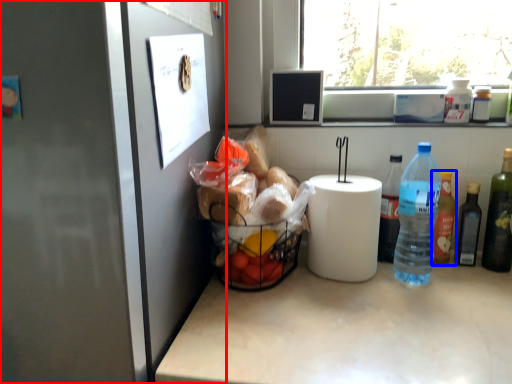
Question: Which of the following is the closest to the observer, fridge (highlighted by a red box) or bottle (highlighted by a blue box)?

Choices:
 (A) fridge
 (B) bottle

Answer: (A)